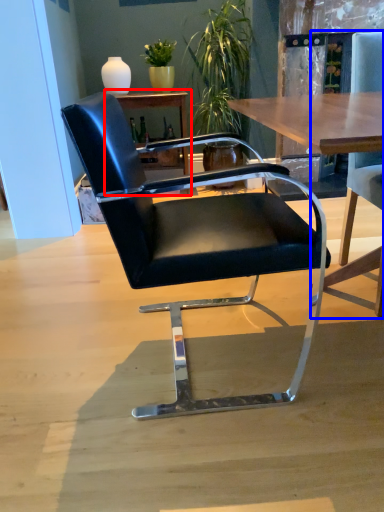
Question: Which of the following is the farthest to the observer, table (highlighted by a red box) or chair (highlighted by a blue box)?

Choices:
 (A) table
 (B) chair

Answer: (A)